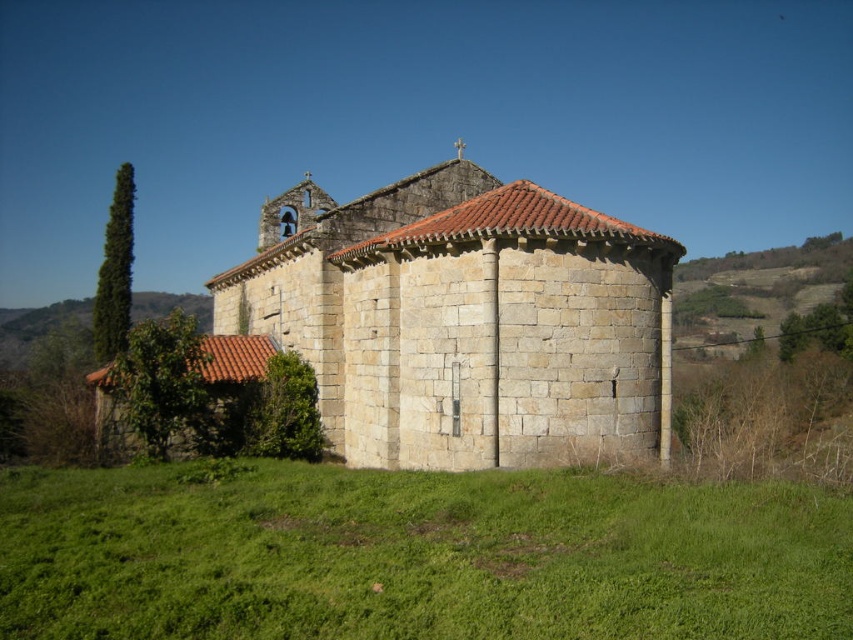
Does green grass at lower center appear on the right side of stone textured chapel at center?

Yes, green grass at lower center is to the right of stone textured chapel at center.

Is green grass at lower center above stone textured chapel at center?

Actually, green grass at lower center is below stone textured chapel at center.

Which is in front, point (567, 524) or point (646, 236)?

Point (567, 524)

The width and height of the screenshot is (853, 640). Find the location of `green grass at lower center`. green grass at lower center is located at coordinates (416, 556).